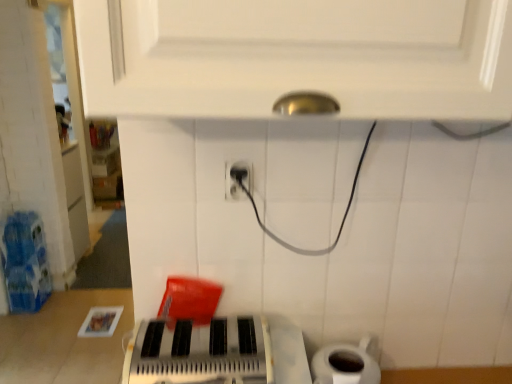
Question: Can you confirm if metallic silver keyboard at center is bigger than black plastic power plug at center?

Choices:
 (A) yes
 (B) no

Answer: (A)

Question: Is metallic silver keyboard at center touching black plastic power plug at center?

Choices:
 (A) no
 (B) yes

Answer: (A)

Question: Is metallic silver keyboard at center oriented away from black plastic power plug at center?

Choices:
 (A) no
 (B) yes

Answer: (A)

Question: Is metallic silver keyboard at center oriented towards black plastic power plug at center?

Choices:
 (A) no
 (B) yes

Answer: (A)

Question: From a real-world perspective, is metallic silver keyboard at center on black plastic power plug at center?

Choices:
 (A) yes
 (B) no

Answer: (B)

Question: Is point (242, 185) closer or farther from the camera than point (355, 382)?

Choices:
 (A) closer
 (B) farther

Answer: (B)

Question: Would you say black plastic power plug at center is to the left or to the right of white matte toilet paper at lower right in the picture?

Choices:
 (A) right
 (B) left

Answer: (B)

Question: Choose the correct answer: Is black plastic power plug at center inside white matte toilet paper at lower right or outside it?

Choices:
 (A) inside
 (B) outside

Answer: (B)

Question: From a real-world perspective, is black plastic power plug at center physically located above or below white matte toilet paper at lower right?

Choices:
 (A) above
 (B) below

Answer: (A)

Question: Considering their positions, is metallic silver keyboard at center located in front of or behind white matte toilet paper at lower right?

Choices:
 (A) behind
 (B) front

Answer: (B)

Question: Looking at the image, does metallic silver keyboard at center seem bigger or smaller compared to white matte toilet paper at lower right?

Choices:
 (A) big
 (B) small

Answer: (A)

Question: From a real-world perspective, relative to white matte toilet paper at lower right, is metallic silver keyboard at center vertically above or below?

Choices:
 (A) above
 (B) below

Answer: (A)

Question: Is point (234, 339) closer or farther from the camera than point (330, 370)?

Choices:
 (A) closer
 (B) farther

Answer: (B)

Question: From their relative heights in the image, would you say metallic silver keyboard at center is taller or shorter than black plastic power plug at center?

Choices:
 (A) short
 (B) tall

Answer: (B)

Question: In terms of size, does metallic silver keyboard at center appear bigger or smaller than black plastic power plug at center?

Choices:
 (A) big
 (B) small

Answer: (A)